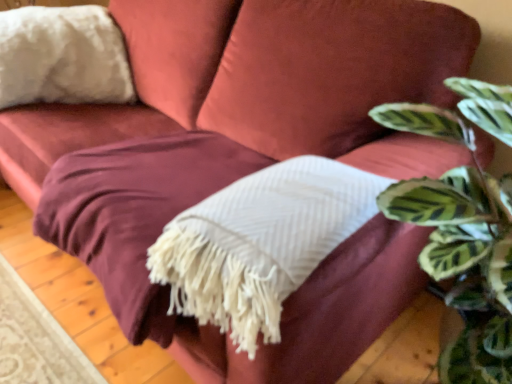
What do you see at coordinates (62, 57) in the screenshot? The width and height of the screenshot is (512, 384). I see `white fluffy pillow at upper left` at bounding box center [62, 57].

I want to click on green striped leaf at upper right, so click(x=460, y=244).

Which object is further away from the camera taking this photo, green striped leaf at upper right or white fluffy pillow at upper left?

white fluffy pillow at upper left is further away from the camera.

Can you tell me how much green striped leaf at upper right and white fluffy pillow at upper left differ in facing direction?

There is a 78.6-degree angle between the facing directions of green striped leaf at upper right and white fluffy pillow at upper left.

Is green striped leaf at upper right oriented away from white fluffy pillow at upper left?

No.

From a real-world perspective, is white textured blanket at center physically below green striped leaf at upper right?

Yes, from a real-world perspective, white textured blanket at center is below green striped leaf at upper right.

Considering the relative sizes of white textured blanket at center and green striped leaf at upper right in the image provided, is white textured blanket at center thinner than green striped leaf at upper right?

Indeed, white textured blanket at center has a lesser width compared to green striped leaf at upper right.

Measure the distance from white textured blanket at center to green striped leaf at upper right.

white textured blanket at center is 23.62 centimeters from green striped leaf at upper right.

Considering the positions of objects white textured blanket at center and green striped leaf at upper right in the image provided, who is behind, white textured blanket at center or green striped leaf at upper right?

Positioned behind is white textured blanket at center.

From a real-world perspective, which is physically below, white fluffy pillow at upper left or white textured blanket at center?

white textured blanket at center.

The width and height of the screenshot is (512, 384). I want to click on blanket directly beneath the white fluffy pillow at upper left (from a real-world perspective), so click(260, 243).

Is white fluffy pillow at upper left wider or thinner than white textured blanket at center?

Considering their sizes, white fluffy pillow at upper left looks broader than white textured blanket at center.

Between white fluffy pillow at upper left and white textured blanket at center, which one has more height?

white fluffy pillow at upper left is taller.

How many degrees apart are the facing directions of white fluffy pillow at upper left and green striped leaf at upper right?

The facing directions of white fluffy pillow at upper left and green striped leaf at upper right are 78.6 degrees apart.

In the scene shown: Which is further, (30, 92) or (463, 353)?

The point (30, 92) is farther.

From the image's perspective, is white fluffy pillow at upper left above or below green striped leaf at upper right?

Clearly, from the image's perspective, white fluffy pillow at upper left is above green striped leaf at upper right.

Is white fluffy pillow at upper left thinner than green striped leaf at upper right?

Correct, the width of white fluffy pillow at upper left is less than that of green striped leaf at upper right.

Considering the relative sizes of green striped leaf at upper right and white textured blanket at center in the image provided, is green striped leaf at upper right shorter than white textured blanket at center?

In fact, green striped leaf at upper right may be taller than white textured blanket at center.

Where is `blanket located behind the green striped leaf at upper right`? This screenshot has height=384, width=512. blanket located behind the green striped leaf at upper right is located at coordinates (260, 243).

Is green striped leaf at upper right situated inside white textured blanket at center or outside?

green striped leaf at upper right lies outside white textured blanket at center.

Is green striped leaf at upper right at the right side of white textured blanket at center?

Correct, you'll find green striped leaf at upper right to the right of white textured blanket at center.

From a real-world perspective, between white textured blanket at center and white fluffy pillow at upper left, who is vertically higher?

white fluffy pillow at upper left.

Is point (227, 256) positioned after point (30, 36)?

No, (227, 256) is closer to viewer.

Looking at this image, considering the relative sizes of white textured blanket at center and white fluffy pillow at upper left in the image provided, is white textured blanket at center wider than white fluffy pillow at upper left?

In fact, white textured blanket at center might be narrower than white fluffy pillow at upper left.

Is white textured blanket at center taller than white fluffy pillow at upper left?

In fact, white textured blanket at center may be shorter than white fluffy pillow at upper left.

The width and height of the screenshot is (512, 384). What are the coordinates of `houseplant below the white fluffy pillow at upper left (from the image's perspective)` in the screenshot? It's located at click(x=460, y=244).

Where is `houseplant that appears on the right of white textured blanket at center`? houseplant that appears on the right of white textured blanket at center is located at coordinates (460, 244).

Based on their spatial positions, is white textured blanket at center or green striped leaf at upper right further from white fluffy pillow at upper left?

Among the two, green striped leaf at upper right is located further to white fluffy pillow at upper left.

Estimate the real-world distances between objects in this image. Which object is further from green striped leaf at upper right, white textured blanket at center or white fluffy pillow at upper left?

Among the two, white fluffy pillow at upper left is located further to green striped leaf at upper right.

When comparing their distances from white textured blanket at center, does green striped leaf at upper right or white fluffy pillow at upper left seem further?

Among the two, white fluffy pillow at upper left is located further to white textured blanket at center.

From the image, which object appears to be farther from white textured blanket at center, white fluffy pillow at upper left or green striped leaf at upper right?

white fluffy pillow at upper left is further to white textured blanket at center.

Estimate the real-world distances between objects in this image. Which object is closer to green striped leaf at upper right, white fluffy pillow at upper left or white textured blanket at center?

white textured blanket at center is closer to green striped leaf at upper right.

Which object lies further to the anchor point white fluffy pillow at upper left, green striped leaf at upper right or white textured blanket at center?

Among the two, green striped leaf at upper right is located further to white fluffy pillow at upper left.

Identify the location of blanket between white fluffy pillow at upper left and green striped leaf at upper right. The height and width of the screenshot is (384, 512). (260, 243).